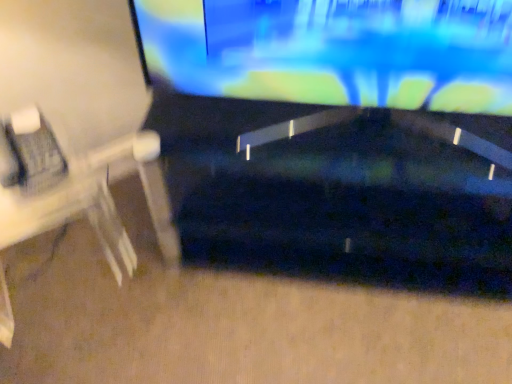
Question: In the image, is white plastic computer desk at left on the left side or the right side of glossy black television at upper center?

Choices:
 (A) left
 (B) right

Answer: (A)

Question: Is white plastic computer desk at left inside the boundaries of glossy black television at upper center, or outside?

Choices:
 (A) inside
 (B) outside

Answer: (B)

Question: Looking at the image, does white plastic computer desk at left seem bigger or smaller compared to glossy black television at upper center?

Choices:
 (A) big
 (B) small

Answer: (A)

Question: From their relative heights in the image, would you say glossy black television at upper center is taller or shorter than white plastic computer desk at left?

Choices:
 (A) short
 (B) tall

Answer: (A)

Question: Do you think glossy black television at upper center is within white plastic computer desk at left, or outside of it?

Choices:
 (A) outside
 (B) inside

Answer: (A)

Question: From the image's perspective, is glossy black television at upper center above or below white plastic computer desk at left?

Choices:
 (A) above
 (B) below

Answer: (A)

Question: Considering their positions, is glossy black television at upper center located in front of or behind white plastic computer desk at left?

Choices:
 (A) front
 (B) behind

Answer: (A)